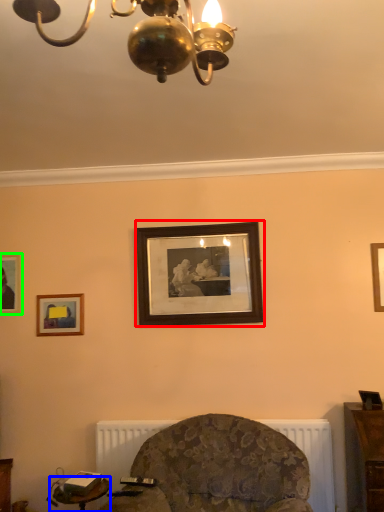
Question: Estimate the real-world distances between objects in this image. Which object is closer to picture frame (highlighted by a red box), table (highlighted by a blue box) or picture frame (highlighted by a green box)?

Choices:
 (A) table
 (B) picture frame

Answer: (B)